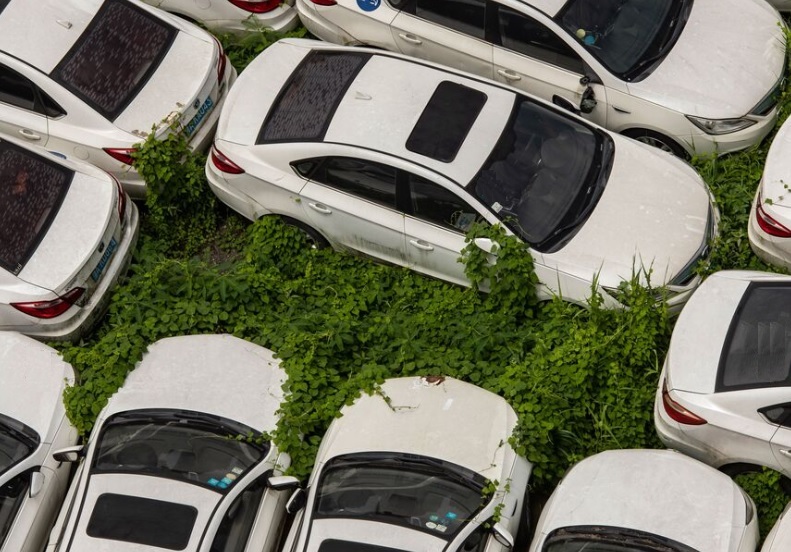
Where is `front windows`? front windows is located at coordinates (536, 163), (627, 26), (587, 540), (405, 490), (171, 447), (8, 444).